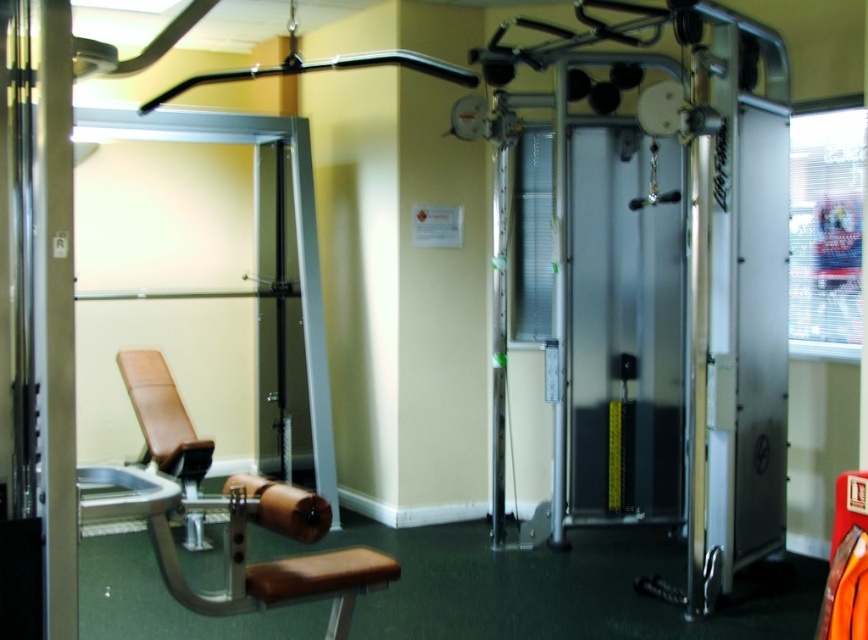
Based on the photo, you are standing in the gym and want to place a new piece of equipment at point [163,419]. Is there already an object at that location?

Yes, there is already a brown leather bench at lower left located at point [163,419].

You are standing at the entrance of the gym and see the brown leather bench at lower left. If you want to walk to it from your current position, how many steps would you need to take if each step covers 0.75 meters?

The distance between you and the brown leather bench at lower left is 5.00 meters. Each step covers 0.75 meters, so dividing 5.00 by 0.75 gives approximately 6.67 steps. Since you can only take whole steps, you would need to take 7 steps to reach the brown leather bench at lower left.

You are a gym member who wants to use the equipment. You see the brown leather bench at lower left and the brown leather bench at lower center. Which one is positioned higher from the ground?

The brown leather bench at lower left is located above the brown leather bench at lower center, so the brown leather bench at lower left is higher from the ground.